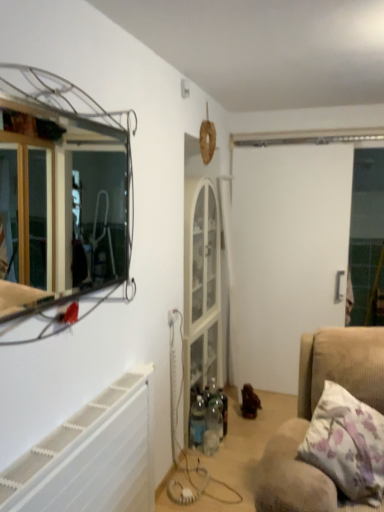
Question: Considering the relative sizes of white plastic radiator at lower left and floral fabric pillow at lower right in the image provided, is white plastic radiator at lower left smaller than floral fabric pillow at lower right?

Choices:
 (A) yes
 (B) no

Answer: (B)

Question: From a real-world perspective, is white plastic radiator at lower left located higher than floral fabric pillow at lower right?

Choices:
 (A) yes
 (B) no

Answer: (B)

Question: Is white plastic radiator at lower left next to floral fabric pillow at lower right?

Choices:
 (A) no
 (B) yes

Answer: (A)

Question: Is the position of white plastic radiator at lower left less distant than that of floral fabric pillow at lower right?

Choices:
 (A) yes
 (B) no

Answer: (A)

Question: Is white plastic radiator at lower left positioned behind floral fabric pillow at lower right?

Choices:
 (A) yes
 (B) no

Answer: (B)

Question: Does white plastic radiator at lower left have a larger size compared to floral fabric pillow at lower right?

Choices:
 (A) no
 (B) yes

Answer: (B)

Question: Can you confirm if metallic wire frame mirror at upper left is smaller than brown wooden toy at center?

Choices:
 (A) no
 (B) yes

Answer: (A)

Question: From a real-world perspective, is metallic wire frame mirror at upper left physically above brown wooden toy at center?

Choices:
 (A) no
 (B) yes

Answer: (B)

Question: Is metallic wire frame mirror at upper left to the right of brown wooden toy at center from the viewer's perspective?

Choices:
 (A) yes
 (B) no

Answer: (B)

Question: Can we say metallic wire frame mirror at upper left lies outside brown wooden toy at center?

Choices:
 (A) no
 (B) yes

Answer: (B)

Question: Can you confirm if metallic wire frame mirror at upper left is shorter than brown wooden toy at center?

Choices:
 (A) no
 (B) yes

Answer: (A)

Question: Does metallic wire frame mirror at upper left contain brown wooden toy at center?

Choices:
 (A) no
 (B) yes

Answer: (A)

Question: Is white matte screen door at center positioned far away from brown wooden toy at center?

Choices:
 (A) no
 (B) yes

Answer: (B)